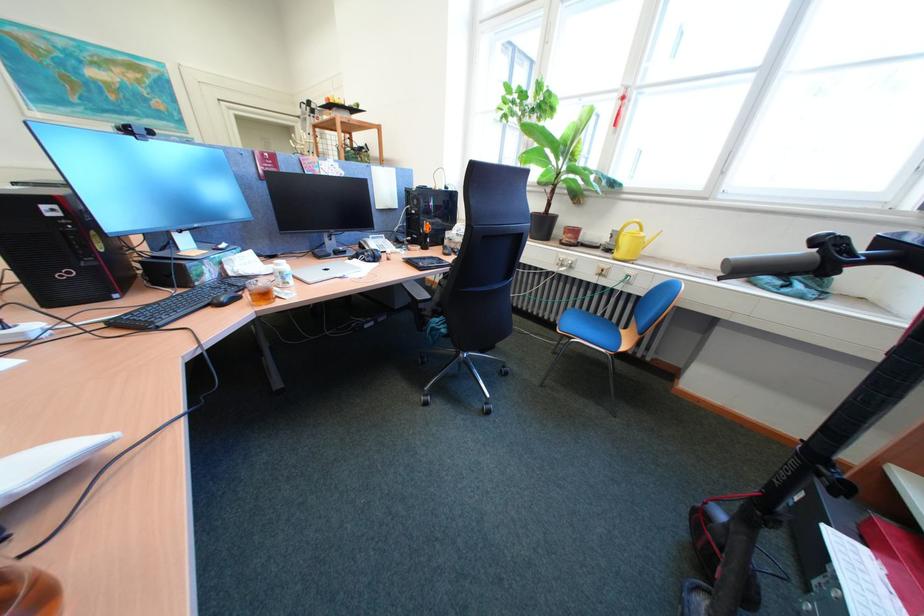
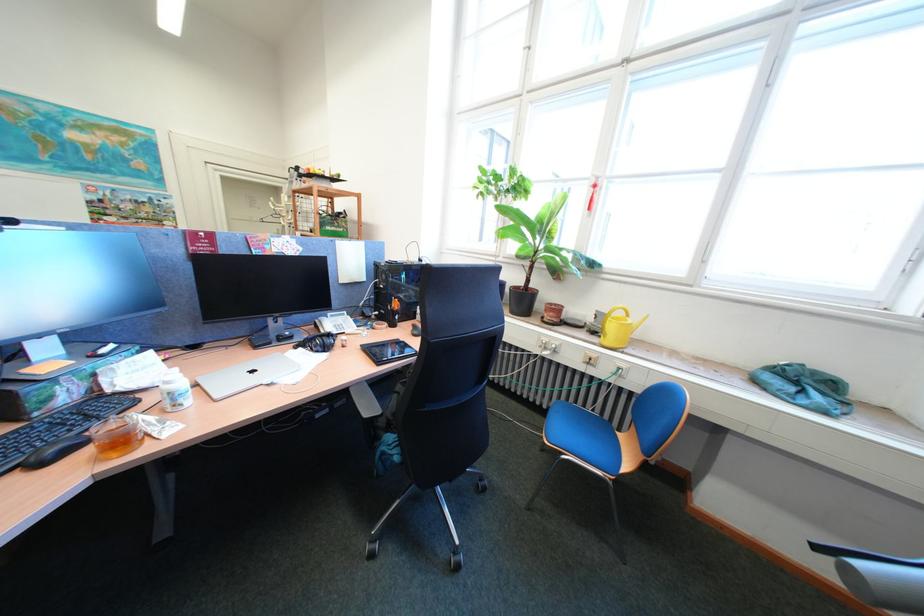
In the second image, find the point that corresponds to point (369, 262) in the first image.

(313, 351)